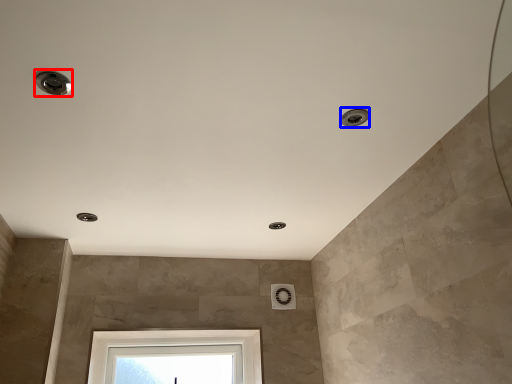
Question: Among these objects, which one is farthest to the camera, droplight (highlighted by a red box) or droplight (highlighted by a blue box)?

Choices:
 (A) droplight
 (B) droplight

Answer: (B)